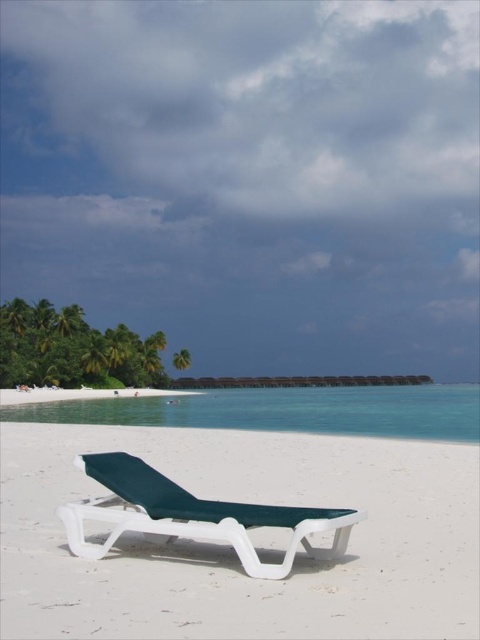
Question: Which point appears closest to the camera in this image?

Choices:
 (A) (116, 531)
 (B) (152, 560)

Answer: (A)

Question: Is the position of white sand at center less distant than that of white plastic beach chair at center?

Choices:
 (A) no
 (B) yes

Answer: (B)

Question: Considering the real-world distances, which object is closest to the white sand at center?

Choices:
 (A) white sand beach at lower left
 (B) white plastic beach chair at center

Answer: (B)

Question: Does white plastic beach chair at center have a lesser width compared to white sand beach at lower left?

Choices:
 (A) no
 (B) yes

Answer: (B)

Question: Which object appears farthest from the camera in this image?

Choices:
 (A) white plastic beach chair at center
 (B) white sand beach at lower left
 (C) white sand at center

Answer: (B)

Question: Is white sand at center bigger than white sand beach at lower left?

Choices:
 (A) yes
 (B) no

Answer: (B)